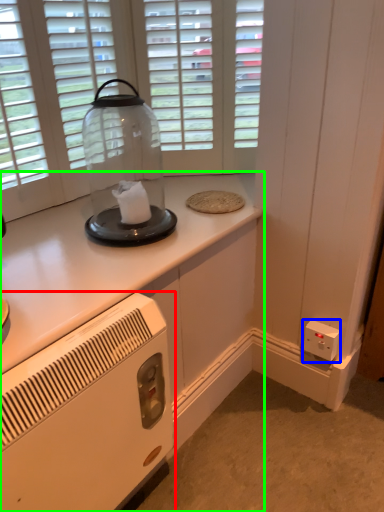
Question: Considering the real-world distances, which object is closest to home appliance (highlighted by a red box)? electric outlet (highlighted by a blue box) or cabinetry (highlighted by a green box).

Choices:
 (A) electric outlet
 (B) cabinetry

Answer: (B)